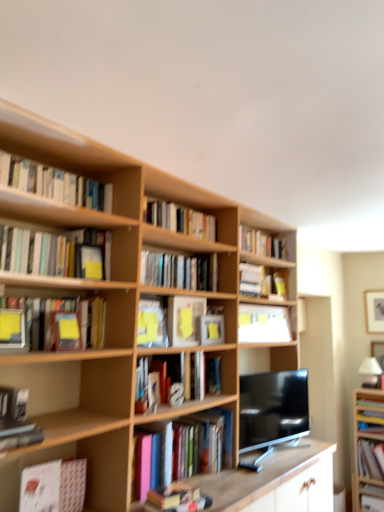
This screenshot has height=512, width=384. What are the coordinates of `free spot above hardcover books at center, which appears as the ninth book when ordered from the bottom (from a real-world perspective)` in the screenshot? It's located at (184, 248).